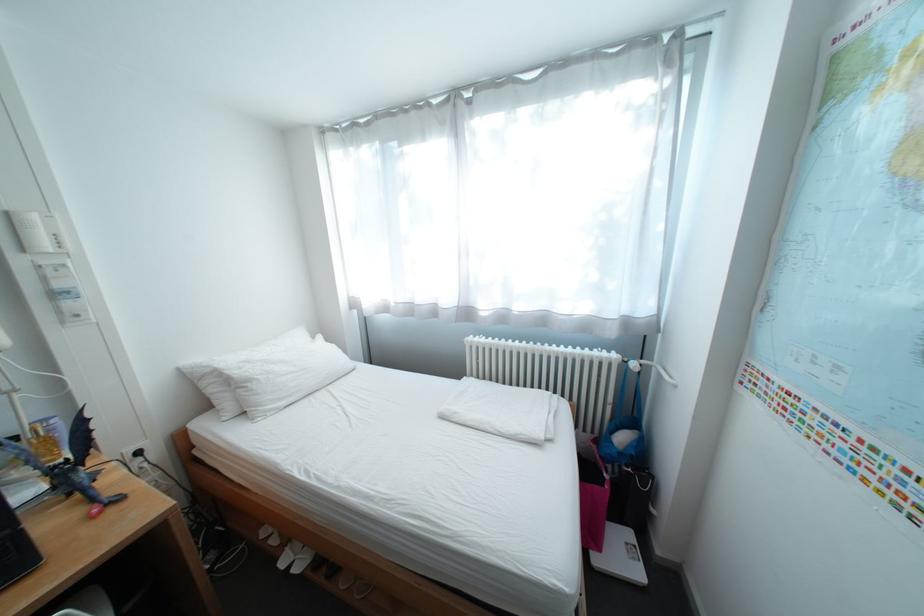
Describe the element at coordinates (140, 468) in the screenshot. I see `the power socket` at that location.